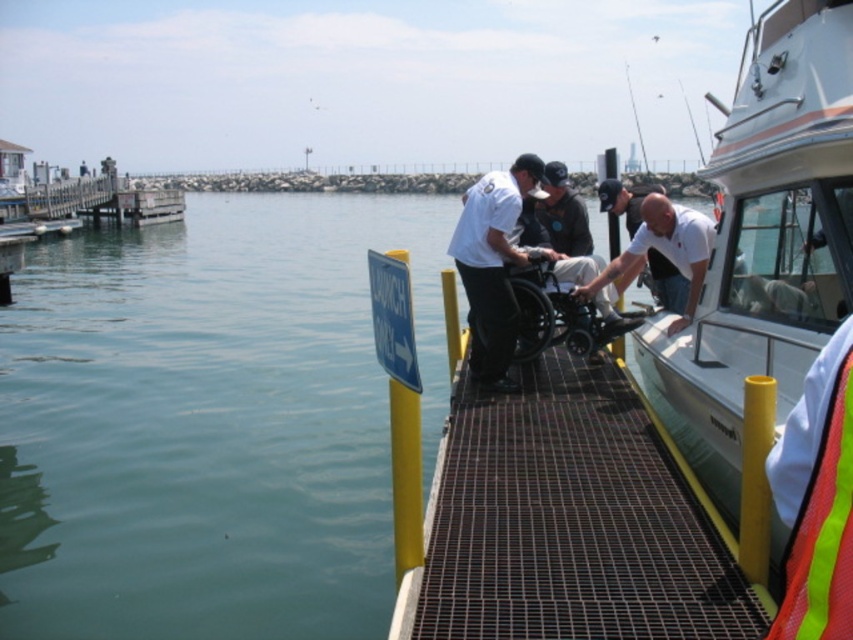
Can you confirm if metallic gray dock at center is positioned to the right of reflective orange life jacket at lower right?

In fact, metallic gray dock at center is to the left of reflective orange life jacket at lower right.

This screenshot has height=640, width=853. Find the location of `metallic gray dock at center`. metallic gray dock at center is located at coordinates (566, 516).

Does white glossy boat at right have a lesser height compared to white uniform at center?

No.

Locate an element on the screen. white glossy boat at right is located at coordinates (764, 241).

Find the location of a particular element. white glossy boat at right is located at coordinates (764, 241).

This screenshot has width=853, height=640. I want to click on white glossy boat at right, so click(x=764, y=241).

This screenshot has height=640, width=853. What are the coordinates of `white glossy boat at right` in the screenshot? It's located at (764, 241).

Is point (767, 310) positioned before point (776, 449)?

No, (767, 310) is further to viewer.

You are a GUI agent. You are given a task and a screenshot of the screen. Output one action in this format:
    pyautogui.click(x=<x>, y=<y>)
    Task: Click on the white glossy boat at right
    The width and height of the screenshot is (853, 640).
    Given the screenshot: What is the action you would take?
    [764, 241]